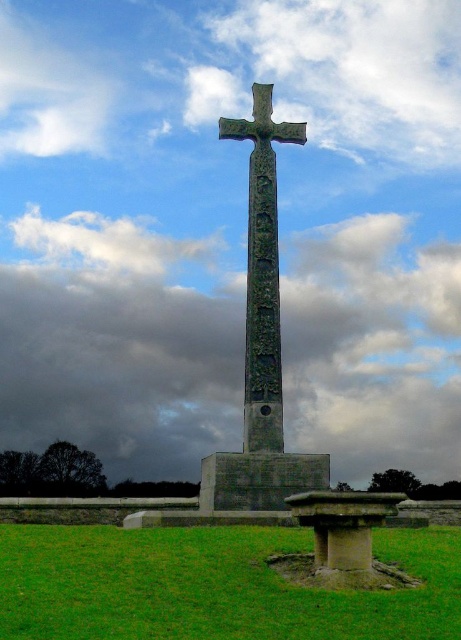
You are standing in front of the green stone cross at center and want to take a photo of the cloudy sky at center. Which object is closer to your camera lens?

The green stone cross at center is closer to the camera lens because the cloudy sky at center is further away, as per the description stating the cloudy sky at center is further to the viewer than the green stone cross at center.

You are standing in front of the monument and want to take a photo that includes both the cloudy sky at center and the green stone cross at center. Which object is taller so that it can be fully captured in the frame?

The green stone cross at center is taller than the cloudy sky at center, so it can be fully captured in the frame.

You are standing in a field and see the green grass at lower center and the green stone cross at center. Which object is located to the left of the other?

The green grass at lower center is positioned on the left side of green stone cross at center.